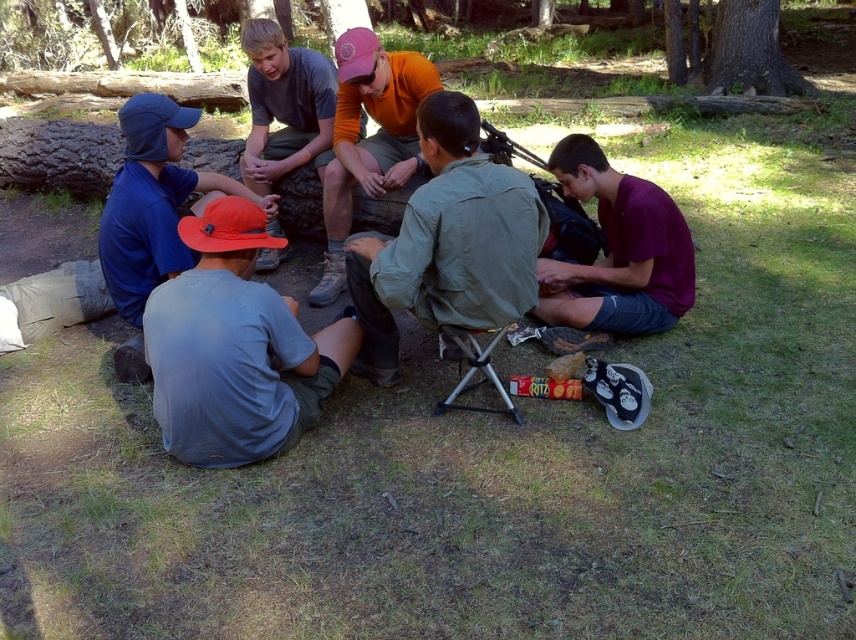
Between gray cotton shirt at lower left and blue fabric cap at left, which one has more height?

With more height is blue fabric cap at left.

Can you confirm if gray cotton shirt at lower left is positioned below blue fabric cap at left?

Yes.

Is point (194, 419) in front of point (57, 326)?

That is True.

Where is `gray cotton shirt at lower left`? This screenshot has width=856, height=640. gray cotton shirt at lower left is located at coordinates (235, 348).

Can you confirm if gray cotton shirt at lower left is bigger than orange cotton shirt at center?

No, gray cotton shirt at lower left is not bigger than orange cotton shirt at center.

Describe the element at coordinates (235, 348) in the screenshot. I see `gray cotton shirt at lower left` at that location.

You are a GUI agent. You are given a task and a screenshot of the screen. Output one action in this format:
    pyautogui.click(x=<x>, y=<y>)
    Task: Click on the gray cotton shirt at lower left
    The image size is (856, 640).
    Given the screenshot: What is the action you would take?
    pyautogui.click(x=235, y=348)

I want to click on gray cotton shirt at lower left, so click(x=235, y=348).

Is maroon fabric shirt at lower right above orange cotton shirt at center?

No.

Looking at this image, does maroon fabric shirt at lower right appear under orange cotton shirt at center?

Yes.

Between point (642, 284) and point (342, 93), which one is positioned behind?

The point (342, 93) is more distant.

The image size is (856, 640). In order to click on maroon fabric shirt at lower right in this screenshot , I will do `click(617, 252)`.